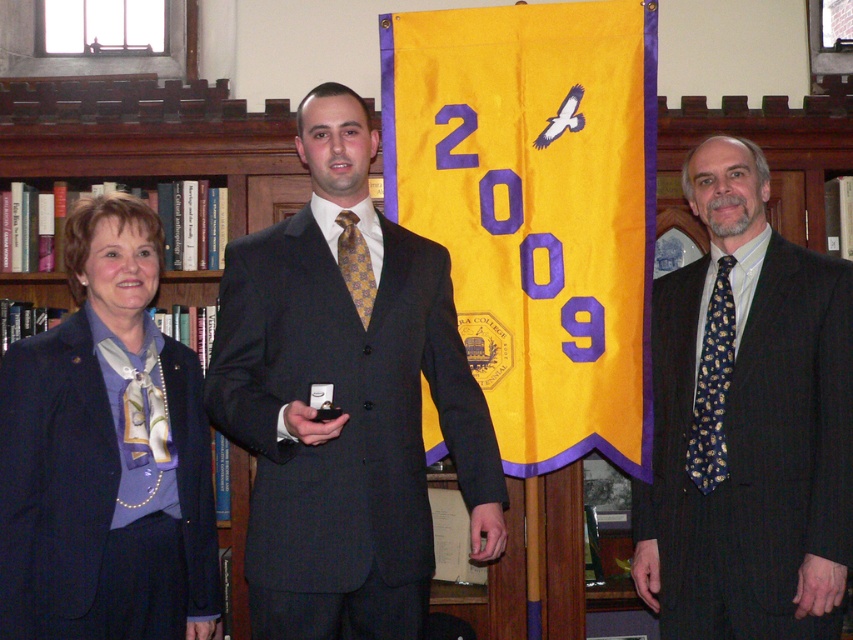
Question: Which point is farther to the camera?

Choices:
 (A) purple satin blazer at left
 (B) dark gray suit at right
 (C) yellow fabric banner at center
 (D) matte black suit at center

Answer: (C)

Question: Is the position of yellow fabric banner at center less distant than that of matte black suit at center?

Choices:
 (A) no
 (B) yes

Answer: (A)

Question: Is yellow fabric banner at center wider than matte black suit at center?

Choices:
 (A) no
 (B) yes

Answer: (B)

Question: Estimate the real-world distances between objects in this image. Which object is closer to the dark gray suit at right?

Choices:
 (A) purple satin blazer at left
 (B) matte black suit at center

Answer: (B)

Question: Which is farther from the purple satin blazer at left?

Choices:
 (A) yellow fabric banner at center
 (B) matte black suit at center
 (C) dark gray suit at right

Answer: (C)

Question: In this image, where is yellow fabric banner at center located relative to dark gray suit at right?

Choices:
 (A) left
 (B) right

Answer: (A)